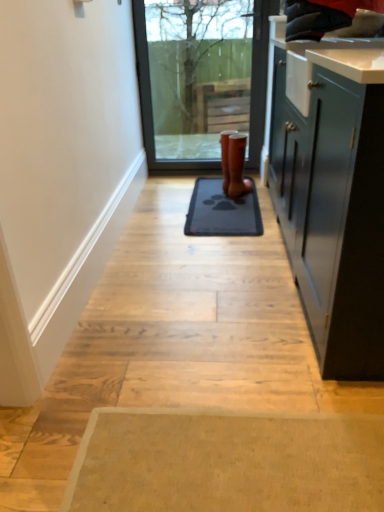
Where is `free space in front of brown leather boot at center`? Image resolution: width=384 pixels, height=512 pixels. free space in front of brown leather boot at center is located at coordinates (248, 200).